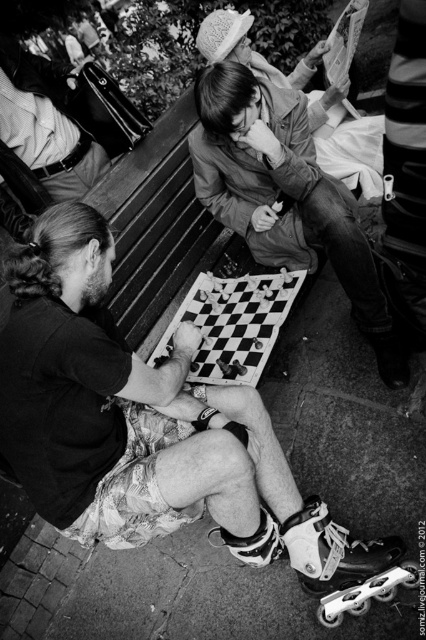
You are a photographer standing in the street scene and want to take a photo of the smooth leather jacket at upper left without the matte black chessboard at center blocking it. How should you adjust your position?

Move to the side so that the smooth leather jacket at upper left is no longer behind the matte black chessboard at center.

You are a photographer standing in the street scene. You want to take a photo of the smooth leather jacket at upper left without the matte black chessboard at center appearing in the frame. Is this possible given their positions?

The matte black chessboard at center is positioned under smooth leather jacket at upper left, so the chessboard would block the view of the jacket. Therefore, it is not possible to capture the smooth leather jacket at upper left without the chessboard appearing in the frame.

You are a photographer trying to capture a closeup of the chessboard. You notice the flannel shirt at center and the smooth leather jacket at upper left in your viewfinder. Which object should you adjust your focus to ensure the chessboard is in the foreground?

The flannel shirt at center is located below the smooth leather jacket at upper left, so adjusting focus to the flannel shirt at center will bring the chessboard into the foreground.